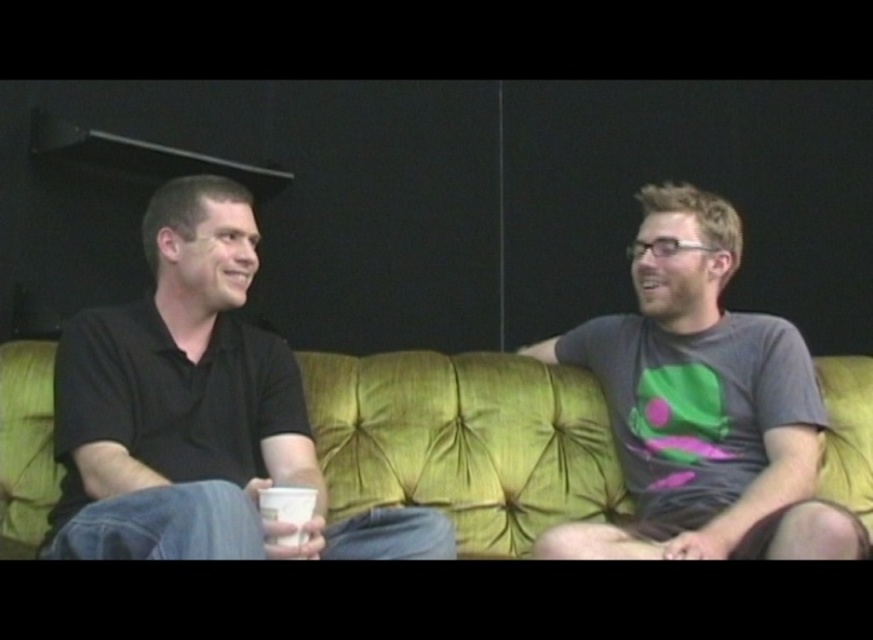
Question: Is gray matte t-shirt at right bigger than white paper cup at center?

Choices:
 (A) no
 (B) yes

Answer: (B)

Question: Based on their relative distances, which object is farther from the black matte shirt at left?

Choices:
 (A) white paper cup at center
 (B) green fabric couch at center

Answer: (B)

Question: Among these points, which one is nearest to the camera?

Choices:
 (A) (260, 490)
 (B) (404, 422)

Answer: (A)

Question: Considering the relative positions of black matte shirt at left and green fabric couch at center in the image provided, where is black matte shirt at left located with respect to green fabric couch at center?

Choices:
 (A) above
 (B) below

Answer: (A)

Question: Which point appears closest to the camera in this image?

Choices:
 (A) (579, 376)
 (B) (287, 490)
 (C) (668, 326)
 (D) (205, 435)

Answer: (B)

Question: Can you confirm if green fabric couch at center is positioned to the left of white paper cup at center?

Choices:
 (A) no
 (B) yes

Answer: (A)